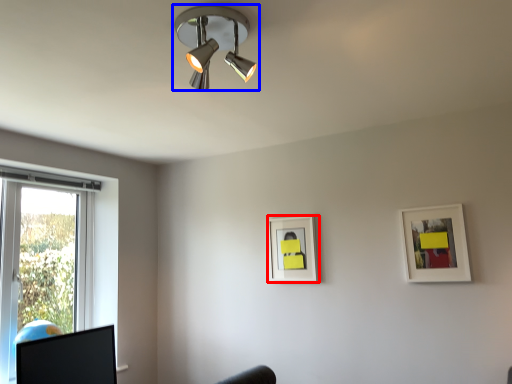
Question: Which of the following is the closest to the observer, picture frame (highlighted by a red box) or lamp (highlighted by a blue box)?

Choices:
 (A) picture frame
 (B) lamp

Answer: (B)